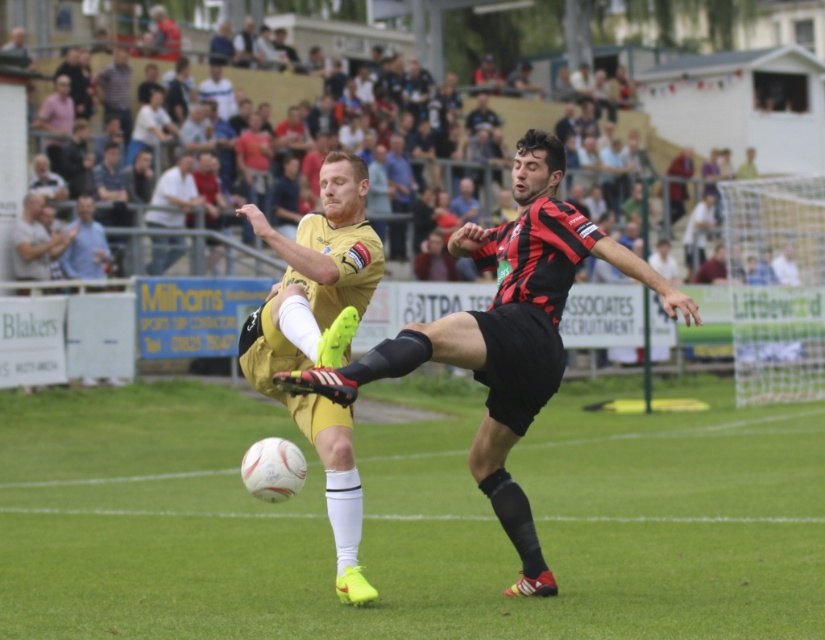
Between point (517, 252) and point (158, 202), which one is positioned in front?

Point (517, 252) is in front.

From the picture: Can you confirm if matte gold jersey at center is positioned to the right of light beige shirt at upper center?

Yes, matte gold jersey at center is to the right of light beige shirt at upper center.

Find the location of `matte gold jersey at center`. matte gold jersey at center is located at coordinates (505, 333).

Find the location of a particular element. This screenshot has width=825, height=640. matte gold jersey at center is located at coordinates click(505, 333).

Does matte gold jersey at center appear over yellow matte jersey at center?

Incorrect, matte gold jersey at center is not positioned above yellow matte jersey at center.

Does matte gold jersey at center have a lesser width compared to yellow matte jersey at center?

Incorrect, matte gold jersey at center's width is not less than yellow matte jersey at center's.

At what (x,y) coordinates should I click in order to perform the action: click on matte gold jersey at center. Please return your answer as a coordinate pair (x, y). Looking at the image, I should click on (505, 333).

Is green grass at center closer to the viewer compared to yellow matte jersey at center?

Yes, it is in front of yellow matte jersey at center.

Can you confirm if green grass at center is taller than yellow matte jersey at center?

Incorrect, green grass at center's height is not larger of yellow matte jersey at center's.

Who is more distant from viewer, (225, 634) or (277, 298)?

Point (277, 298)

Identify the location of green grass at center. (409, 518).